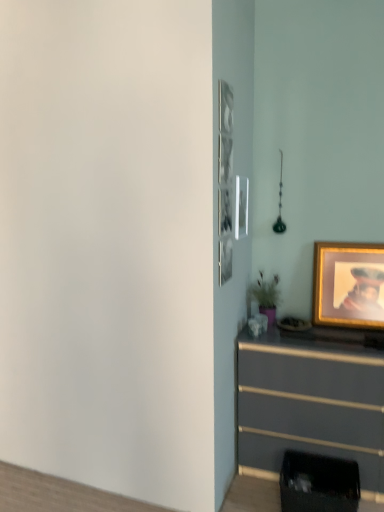
Question: From the image's perspective, relative to gold-framed picture at right, is matte gray chest of drawers at lower right above or below?

Choices:
 (A) above
 (B) below

Answer: (B)

Question: Does point (360, 425) appear closer or farther from the camera than point (377, 251)?

Choices:
 (A) closer
 (B) farther

Answer: (A)

Question: From a real-world perspective, is matte gray chest of drawers at lower right above or below gold-framed picture at right?

Choices:
 (A) below
 (B) above

Answer: (A)

Question: In the image, is gold-framed picture at right on the left side or the right side of matte gray chest of drawers at lower right?

Choices:
 (A) left
 (B) right

Answer: (B)

Question: Considering the positions of gold-framed picture at right and matte gray chest of drawers at lower right in the image, is gold-framed picture at right wider or thinner than matte gray chest of drawers at lower right?

Choices:
 (A) thin
 (B) wide

Answer: (A)

Question: Considering the positions of gold-framed picture at right and matte gray chest of drawers at lower right in the image, is gold-framed picture at right bigger or smaller than matte gray chest of drawers at lower right?

Choices:
 (A) big
 (B) small

Answer: (B)

Question: Is gold-framed picture at right situated inside matte gray chest of drawers at lower right or outside?

Choices:
 (A) outside
 (B) inside

Answer: (A)